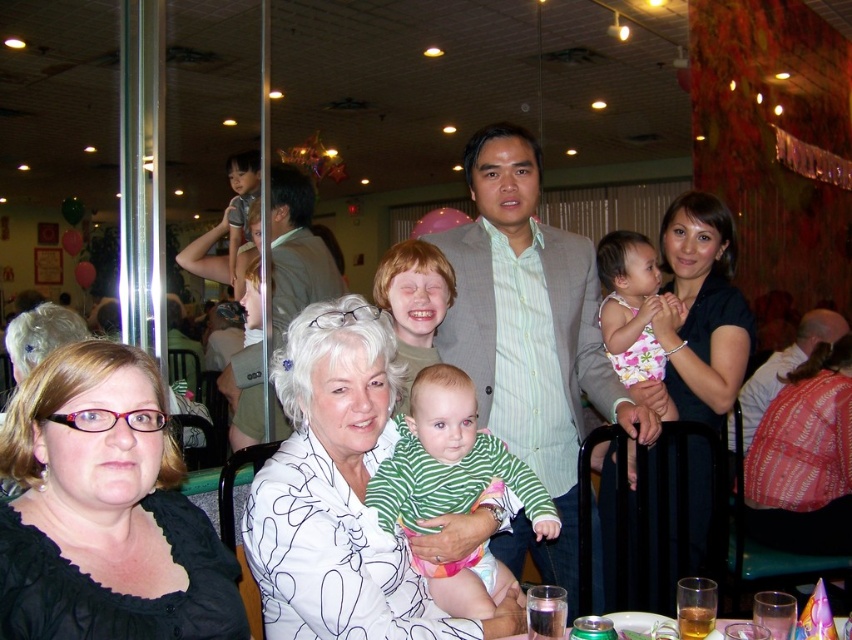
Question: Estimate the real-world distances between objects in this image. Which object is farther from the white printed blouse at center?

Choices:
 (A) black matte shirt at lower left
 (B) green striped shirt at center
 (C) light brown hair at right

Answer: (C)

Question: Does black matte shirt at lower left have a lesser width compared to light gray suit at center?

Choices:
 (A) yes
 (B) no

Answer: (A)

Question: Considering the relative positions of light gray suit at center and green striped shirt at center in the image provided, where is light gray suit at center located with respect to green striped shirt at center?

Choices:
 (A) above
 (B) below

Answer: (A)

Question: Can you confirm if light gray suit at center is thinner than light brown hair at right?

Choices:
 (A) yes
 (B) no

Answer: (A)

Question: Which of these objects is positioned closest to the black matte shirt at lower left?

Choices:
 (A) light brown hair at right
 (B) white dotted dress at center
 (C) green striped shirt at center

Answer: (C)

Question: Which point is closer to the camera?

Choices:
 (A) black matte shirt at lower left
 (B) green striped shirt at center
 (C) white printed blouse at center
 (D) light gray suit at center

Answer: (A)